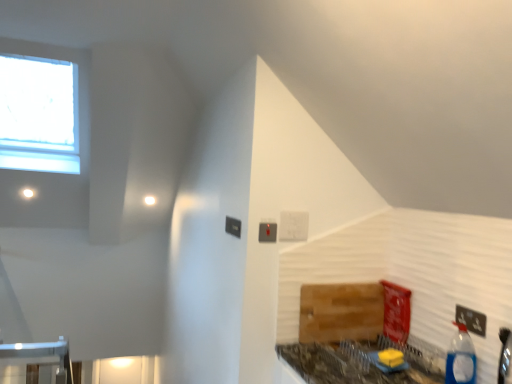
Question: Relative to wooden cutting board at lower right, is black plastic electric outlet at lower right in front or behind?

Choices:
 (A) behind
 (B) front

Answer: (B)

Question: From a real-world perspective, is black plastic electric outlet at lower right positioned above or below wooden cutting board at lower right?

Choices:
 (A) above
 (B) below

Answer: (A)

Question: Estimate the real-world distances between objects in this image. Which object is closer to the wooden cutting board at lower right?

Choices:
 (A) black plastic electric outlet at lower right
 (B) marble-patterned countertop at lower right
 (C) blue plastic bottle at lower right

Answer: (B)

Question: Which object is the farthest from the blue plastic bottle at lower right?

Choices:
 (A) wooden cutting board at lower right
 (B) black plastic electric outlet at lower right
 (C) marble-patterned countertop at lower right

Answer: (A)